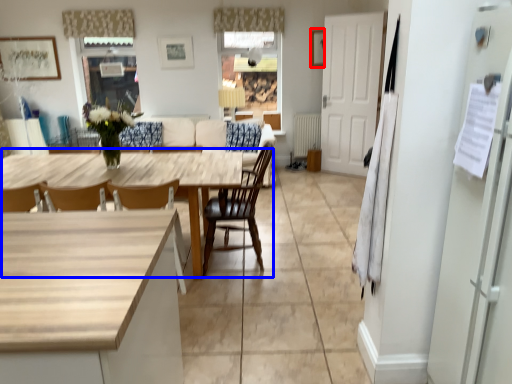
Question: Which object appears farthest to the camera in this image, picture frame (highlighted by a red box) or kitchen & dining room table (highlighted by a blue box)?

Choices:
 (A) picture frame
 (B) kitchen & dining room table

Answer: (A)